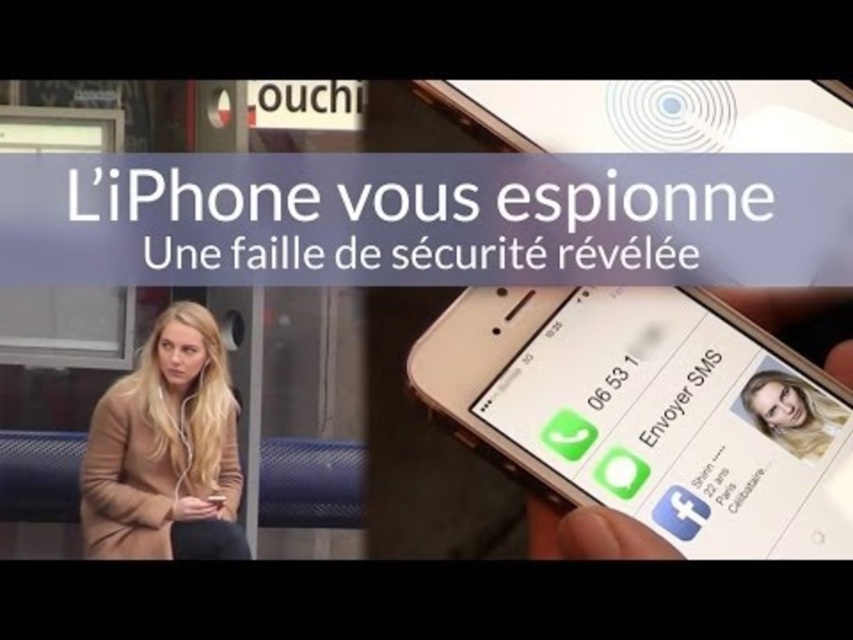
You are a graphic designer reviewing this image for a client. You notice two white texts in the image. Which one appears closer to you, the white paper text at upper center or the white glossy text message at center?

The white paper text at upper center appears closer because the white glossy text message at center is positioned behind it.

You are a graphic designer reviewing this image for a client. You need to determine if the gold metallic smartphone at center and the blonde hair at upper right are sized appropriately for the layout. Based on their sizes, which object occupies more vertical space in the image?

The gold metallic smartphone at center is much taller than the blonde hair at upper right, so it occupies more vertical space.